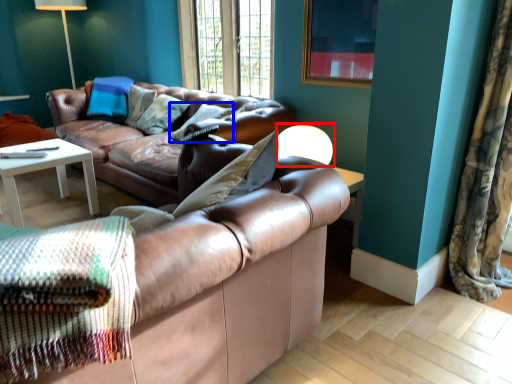
Question: Among these objects, which one is farthest to the camera, table lamp (highlighted by a red box) or pillow (highlighted by a blue box)?

Choices:
 (A) table lamp
 (B) pillow

Answer: (B)